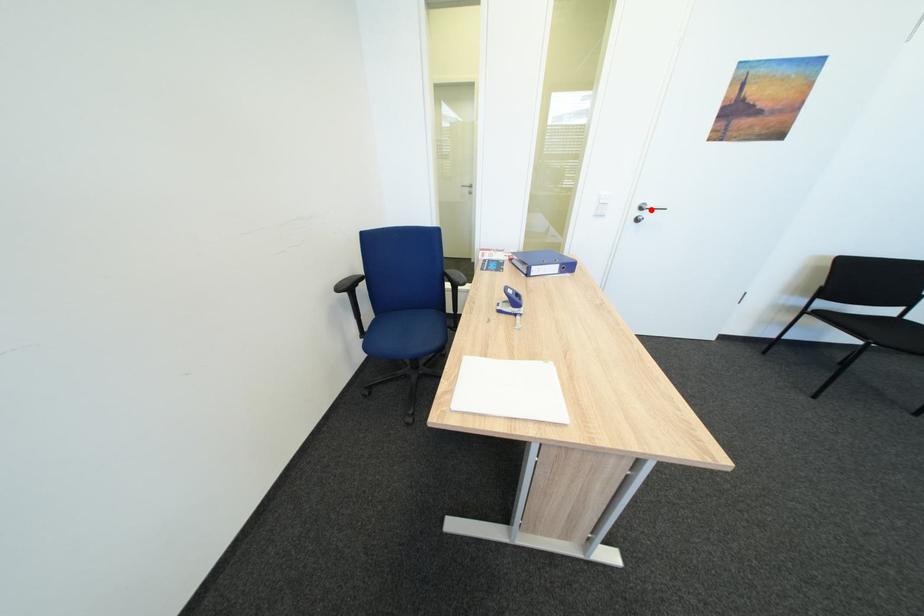
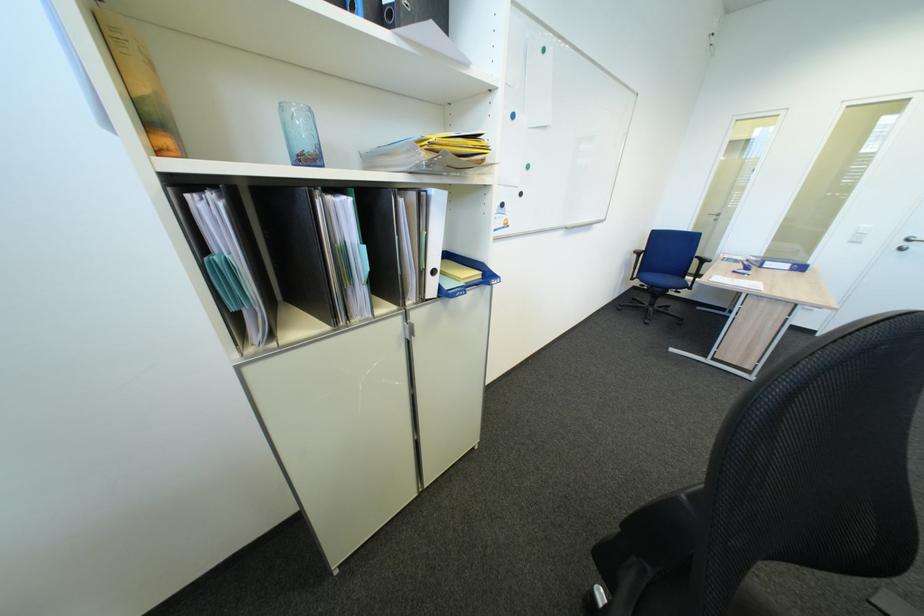
Find the pixel in the second image that matches the highlighted location in the first image.

(918, 241)